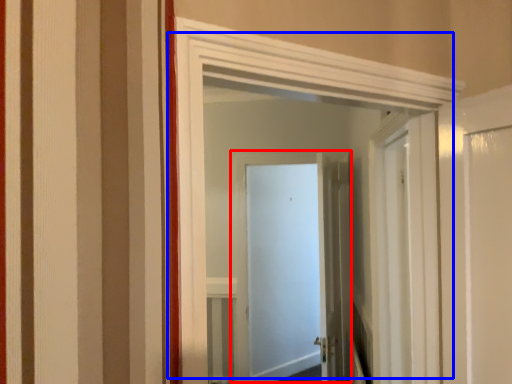
Question: Which object appears farthest to the camera in this image, door (highlighted by a red box) or door (highlighted by a blue box)?

Choices:
 (A) door
 (B) door

Answer: (A)